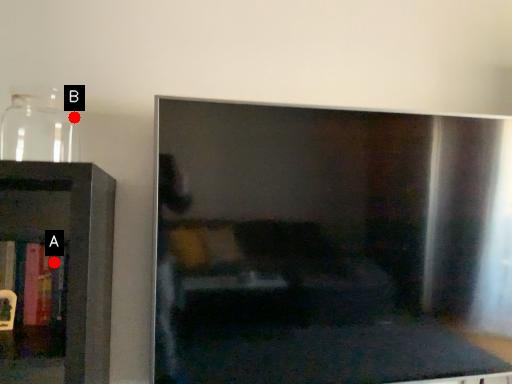
Question: Two points are circled on the image, labeled by A and B beside each circle. Which of the following is the farthest from the observer?

Choices:
 (A) A is further
 (B) B is further

Answer: (B)